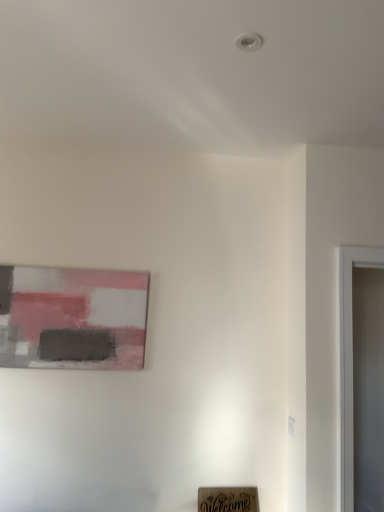
The image size is (384, 512). What do you see at coordinates (72, 318) in the screenshot?
I see `matte acrylic painting at upper left` at bounding box center [72, 318].

At what (x,y) coordinates should I click in order to perform the action: click on matte acrylic painting at upper left. Please return your answer as a coordinate pair (x, y). This screenshot has width=384, height=512. Looking at the image, I should click on (72, 318).

This screenshot has height=512, width=384. I want to click on matte acrylic painting at upper left, so click(x=72, y=318).